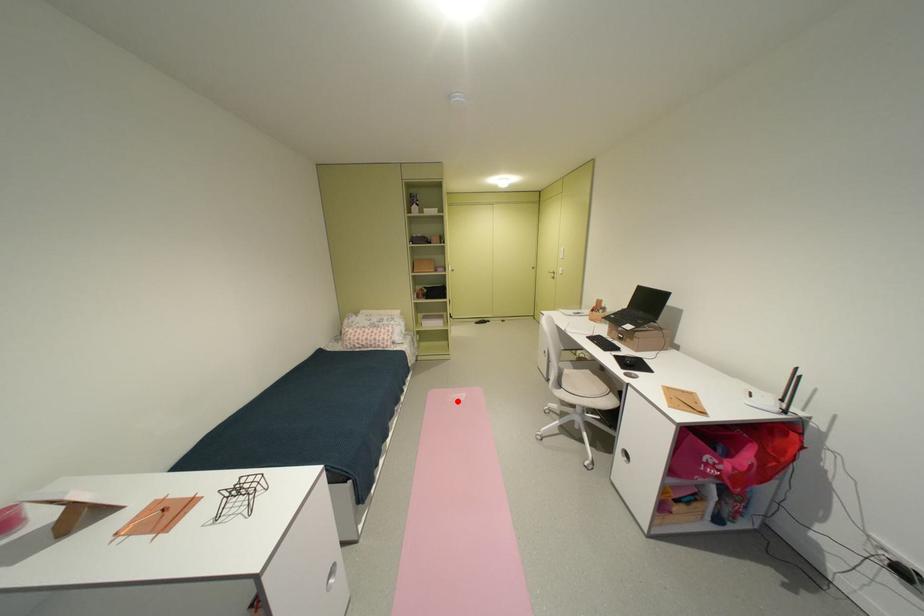
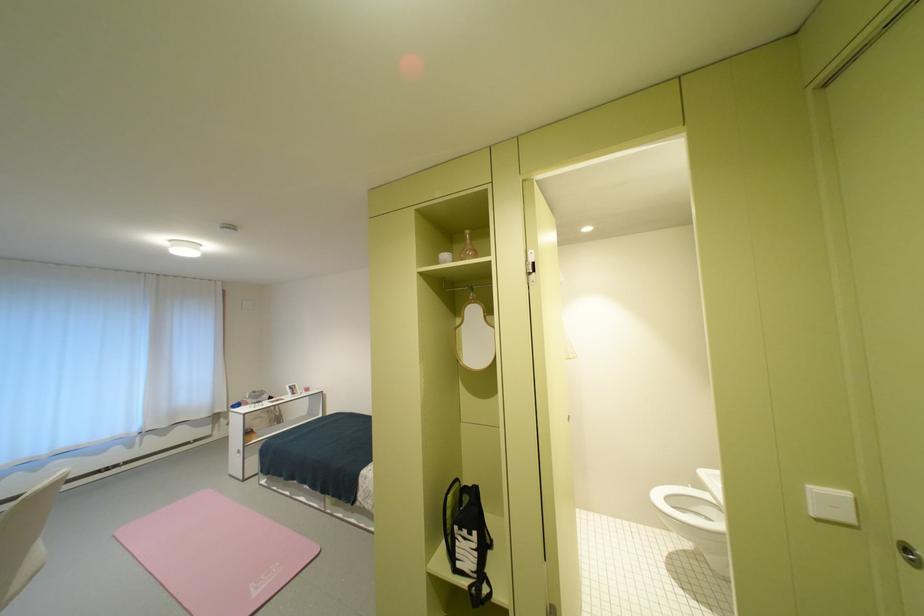
In the second image, find the point that corresponds to the highlighted location in the first image.

(286, 565)